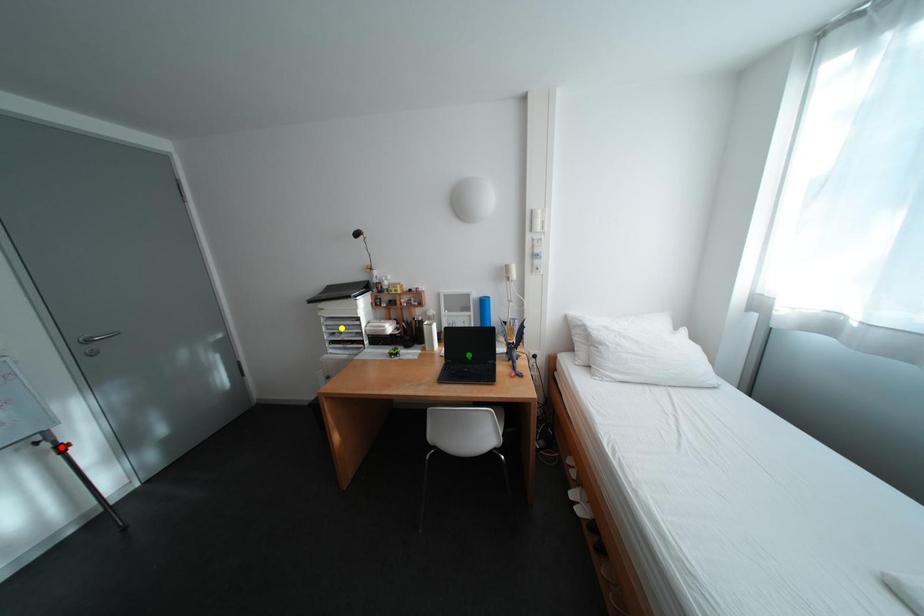
Looking at this image, order these from nearest to farthest:
A) green point
B) yellow point
C) red point

yellow point
green point
red point